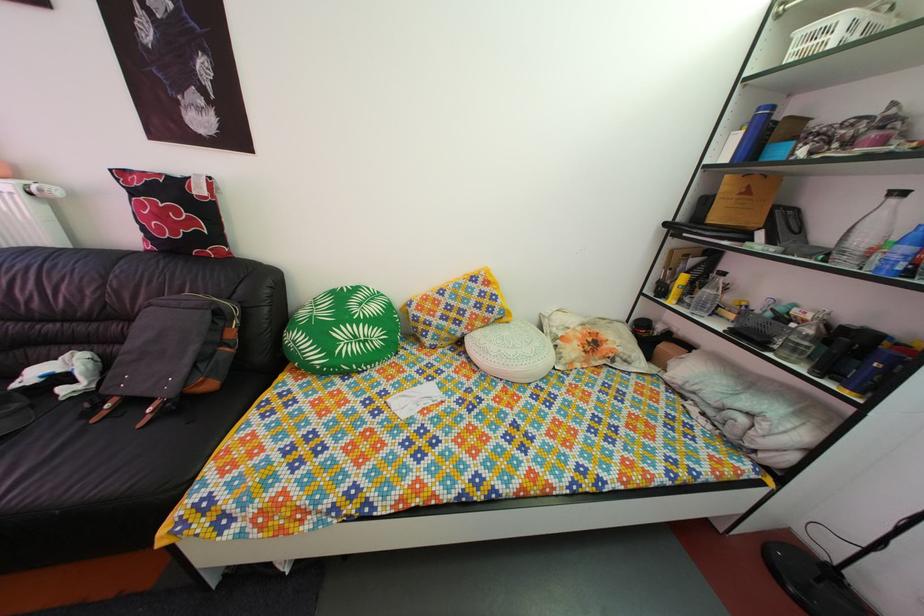
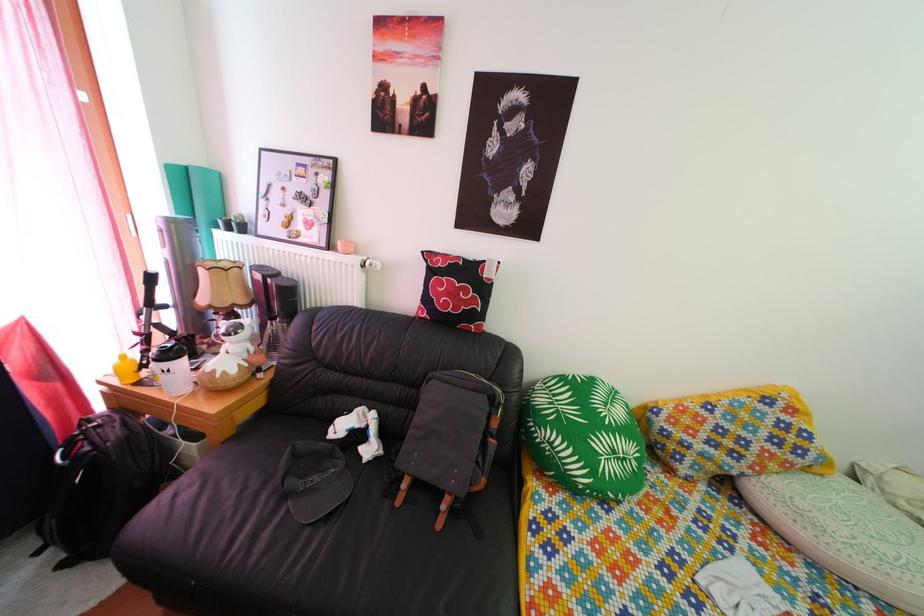
Question: The first image is from the beginning of the video and the second image is from the end. How did the camera likely rotate when shooting the video?

Choices:
 (A) Left
 (B) Right
 (C) Up
 (D) Down

Answer: (A)